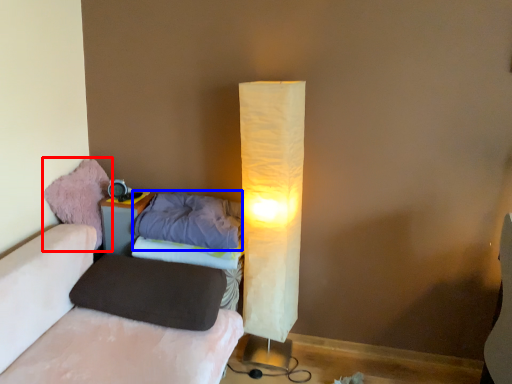
Question: Which of the following is the farthest to the observer, bean bag chair (highlighted by a red box) or pillow (highlighted by a blue box)?

Choices:
 (A) bean bag chair
 (B) pillow

Answer: (A)